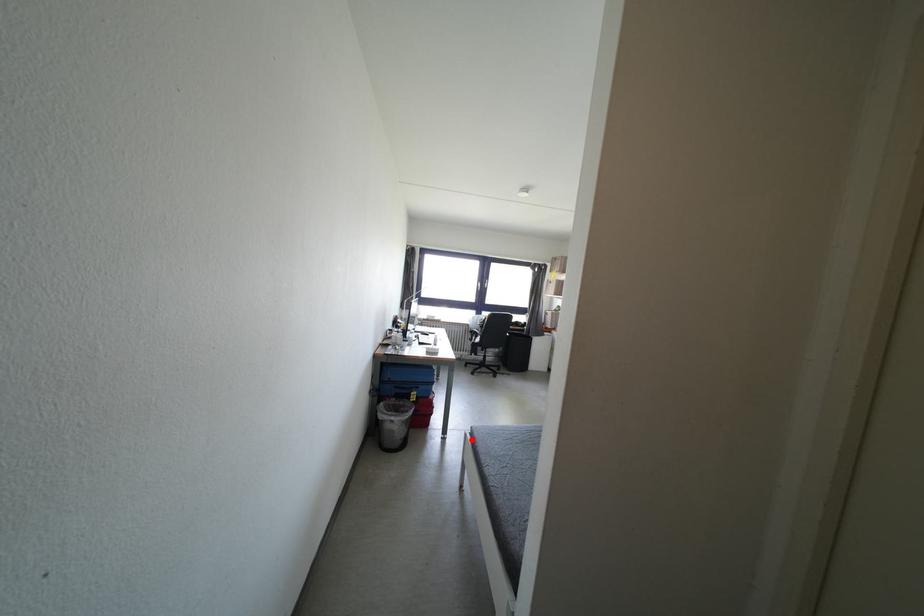
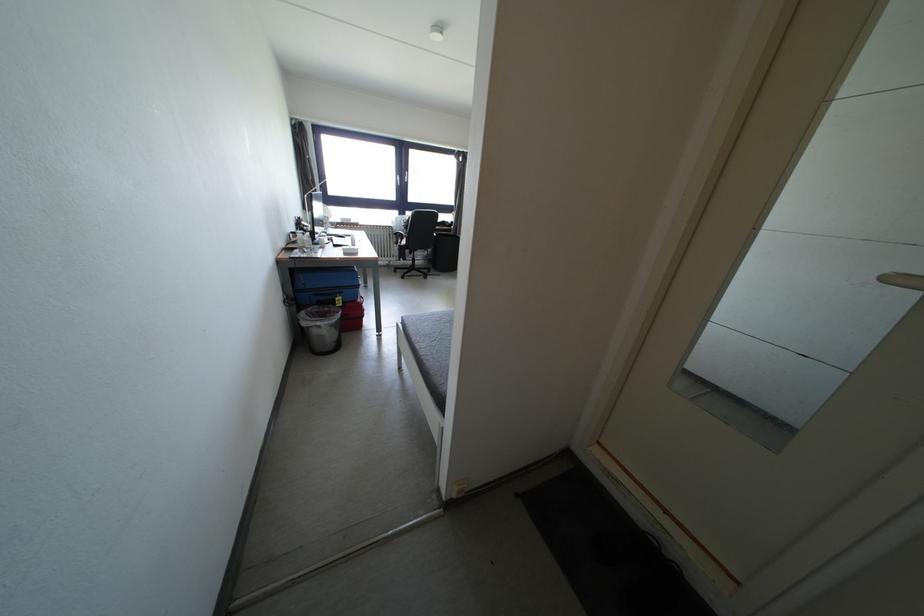
Question: I am providing you with two images of the same scene from different viewpoints. A red point is shown in image1. For the corresponding object point in image2, is it positioned nearer or farther from the camera?

Choices:
 (A) Nearer
 (B) Farther

Answer: (B)